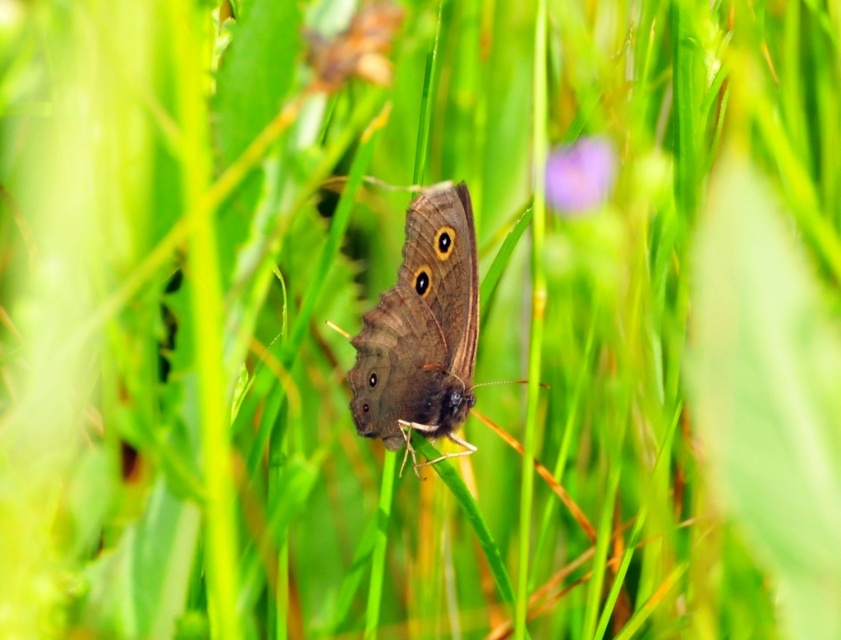
Question: Which point is farther to the camera?

Choices:
 (A) brown matte butterfly at center
 (B) brown textured leaf at upper center
 (C) purple matte flower at upper center

Answer: (A)

Question: Which object is farther from the camera taking this photo?

Choices:
 (A) brown textured leaf at upper center
 (B) purple matte flower at upper center
 (C) brown matte butterfly at center

Answer: (C)

Question: Is brown textured leaf at upper center positioned in front of purple matte flower at upper center?

Choices:
 (A) no
 (B) yes

Answer: (B)

Question: Is brown matte butterfly at center below purple matte flower at upper center?

Choices:
 (A) no
 (B) yes

Answer: (B)

Question: Is the position of brown matte butterfly at center less distant than that of purple matte flower at upper center?

Choices:
 (A) yes
 (B) no

Answer: (B)

Question: Which point is closer to the camera?

Choices:
 (A) purple matte flower at upper center
 (B) brown matte butterfly at center
 (C) brown textured leaf at upper center

Answer: (C)